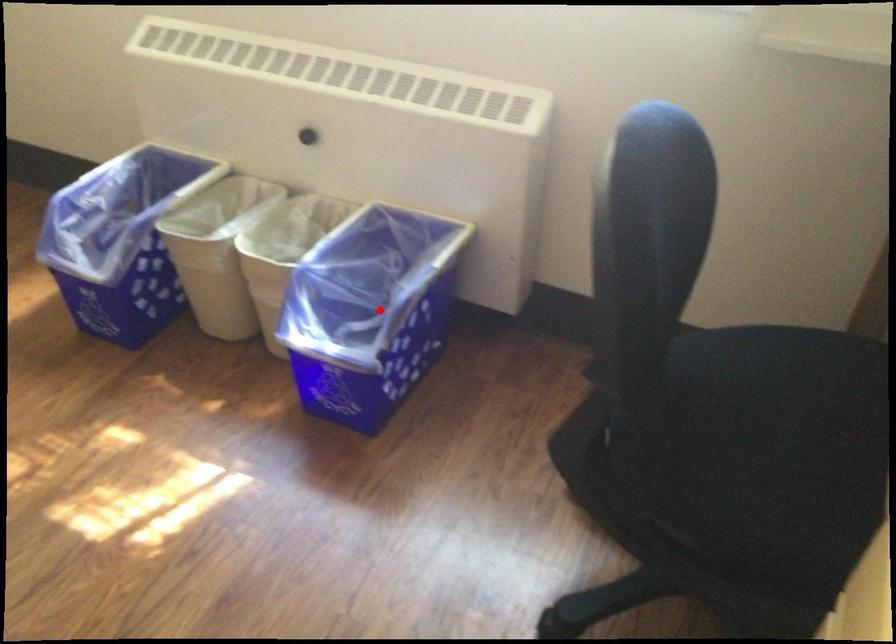
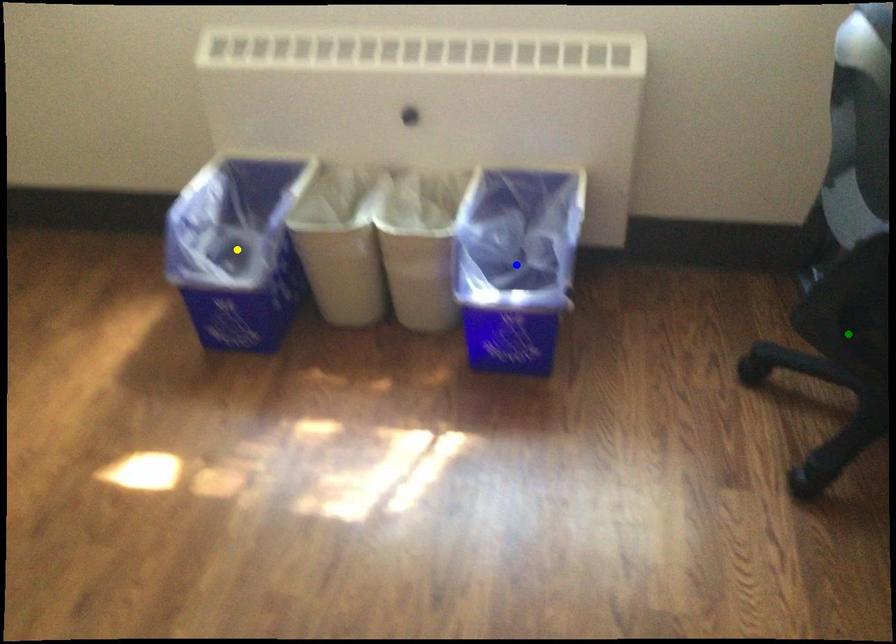
Question: I am providing you with two images of the same scene from different viewpoints. A red point is marked on the first image. You are given multiple points on the second image. Which mark in image 2 goes with the point in image 1?

Choices:
 (A) blue point
 (B) green point
 (C) yellow point

Answer: (A)